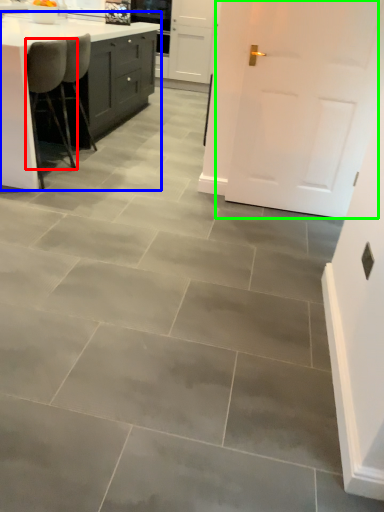
Question: Based on their relative distances, which object is nearer to chair (highlighted by a red box)? Choose from countertop (highlighted by a blue box) and door (highlighted by a green box).

Choices:
 (A) countertop
 (B) door

Answer: (A)